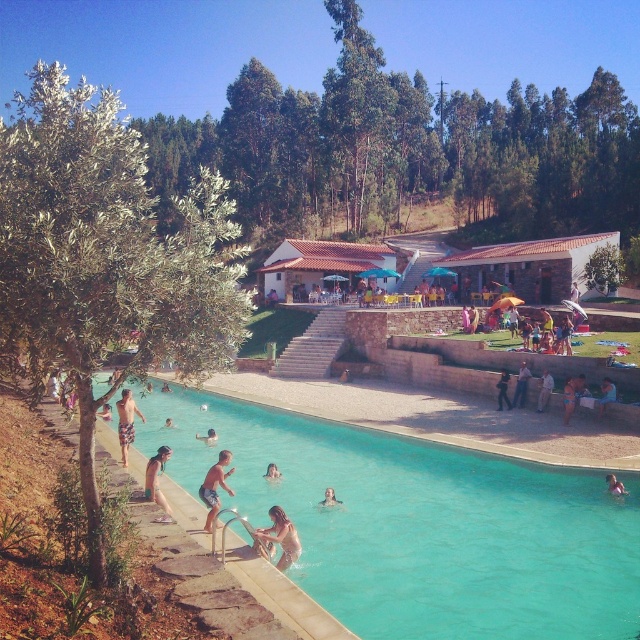
Is green fabric bikini at lower left bigger than smooth skin person at lower center?

Correct, green fabric bikini at lower left is larger in size than smooth skin person at lower center.

At what (x,y) coordinates should I click in order to perform the action: click on green fabric bikini at lower left. Please return your answer as a coordinate pair (x, y). This screenshot has height=640, width=640. Looking at the image, I should click on click(x=157, y=483).

Who is more forward, (150, 461) or (266, 477)?

Positioned in front is point (150, 461).

I want to click on green fabric bikini at lower left, so click(157, 483).

Does tan skin human at center have a larger size compared to smooth beige towel at lower left?

Incorrect, tan skin human at center is not larger than smooth beige towel at lower left.

Which is above, tan skin human at center or smooth beige towel at lower left?

smooth beige towel at lower left is above.

Describe the element at coordinates (214, 486) in the screenshot. I see `tan skin human at center` at that location.

Identify the location of tan skin human at center. (214, 486).

Can you confirm if plaid shorts at lower left is taller than light blue fabric swimmer at lower center?

Indeed, plaid shorts at lower left has a greater height compared to light blue fabric swimmer at lower center.

Between plaid shorts at lower left and light blue fabric swimmer at lower center, which one is positioned higher?

Positioned higher is plaid shorts at lower left.

This screenshot has height=640, width=640. I want to click on plaid shorts at lower left, so click(125, 422).